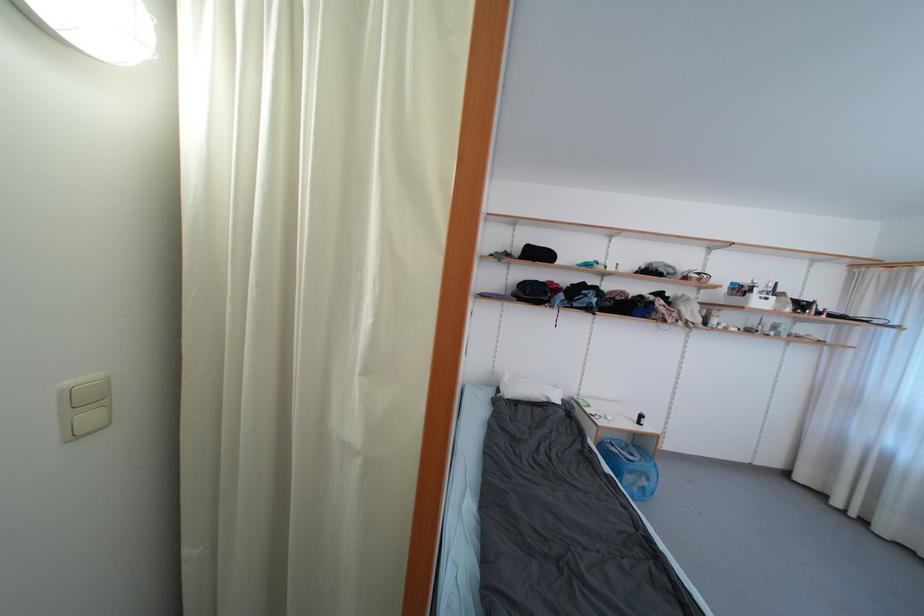
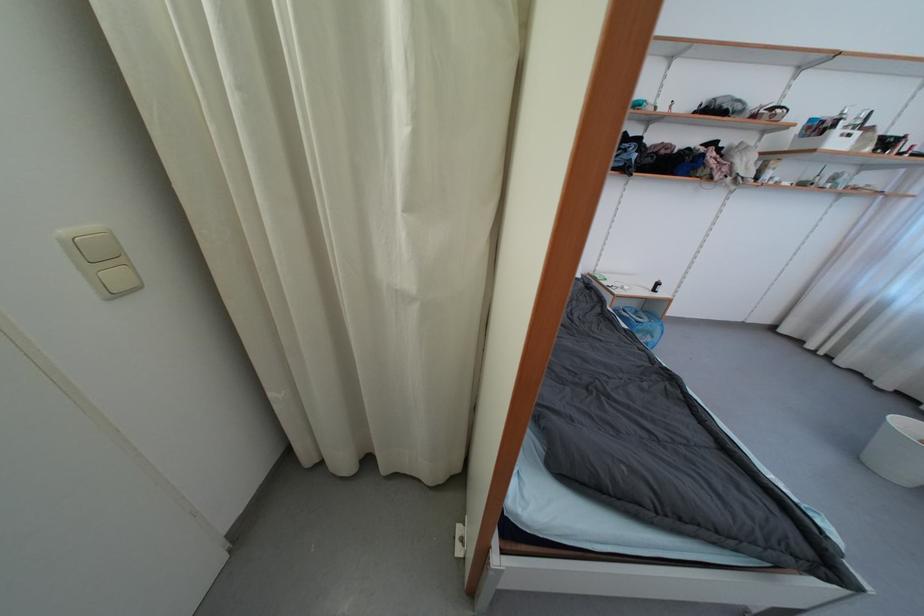
Find the pixel in the second image that matches pixel 92 419 in the first image.

(119, 278)